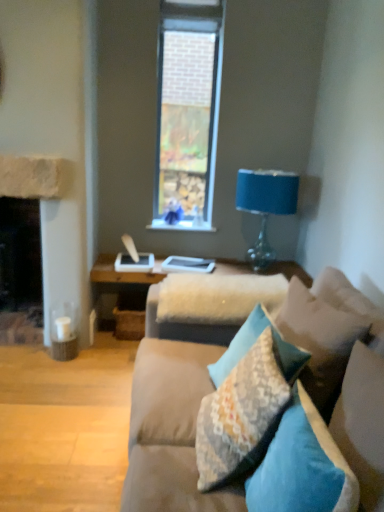
Question: Based on their positions, is textured cotton pillow at center, which is the 3th pillow from front to back, located to the left or right of textured beige pillow at lower right, which is the second pillow from back to front?

Choices:
 (A) left
 (B) right

Answer: (A)

Question: From a real-world perspective, is textured cotton pillow at center, the third pillow viewed from the back, positioned above or below textured beige pillow at lower right, arranged as the 4th pillow when viewed from the front?

Choices:
 (A) above
 (B) below

Answer: (B)

Question: Estimate the real-world distances between objects in this image. Which object is closer to the teal fabric pillow at center, placed as the fourth pillow when sorted from back to front?

Choices:
 (A) textured beige pillow at lower right, arranged as the 4th pillow when viewed from the front
 (B) blue fabric-covered lamp at upper right
 (C) fuzzy fabric table at center
 (D) teal fabric pillow at center, placed as the fifth pillow when sorted from back to front
 (E) textured floral pillow at center, placed as the 1th pillow when sorted from back to front

Answer: (D)

Question: Which of these objects is positioned closest to the suede couch at center?

Choices:
 (A) textured cotton pillow at center, the third pillow viewed from the back
 (B) teal fabric pillow at center, acting as the second pillow starting from the front
 (C) fuzzy fabric table at center
 (D) textured floral pillow at center, the fifth pillow positioned from the front
 (E) textured beige pillow at lower right, which is the second pillow from back to front

Answer: (A)